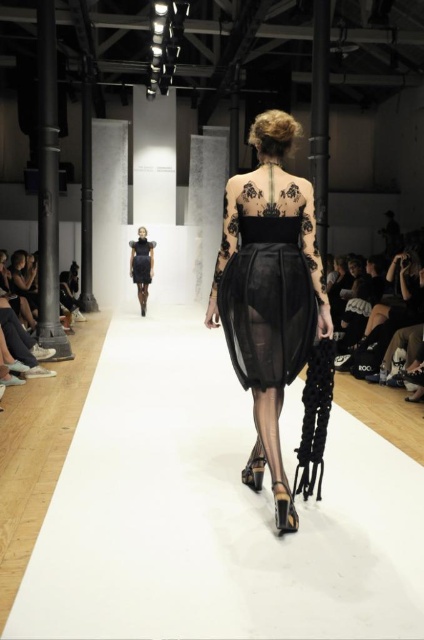
You are a photographer positioned at the end of the runway. You need to capture a closeup shot of the sheer black fabric dress at center and the matte black dress at center. Which dress will require you to step back further to frame properly?

The sheer black fabric dress at center requires stepping back further because its width is larger than the matte black dress at center, necessitating a wider angle or more distance to fully capture it in the frame.

As a photographer positioned at the starting point of the runway, you notice two points marked in the image. Which point, point (130, 243) or point (134, 264), is closer to your current position?

Point (134, 264) is closer to your current position because it is in front of point (130, 243).